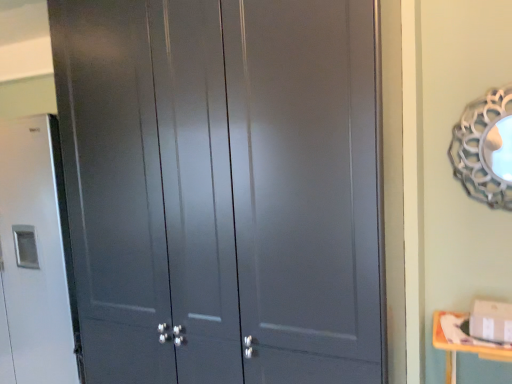
Question: Is matte gray cabinet at center turned away from matte gray cabinet at left?

Choices:
 (A) yes
 (B) no

Answer: (B)

Question: Does matte gray cabinet at center have a larger size compared to matte gray cabinet at left?

Choices:
 (A) no
 (B) yes

Answer: (B)

Question: Can you confirm if matte gray cabinet at center is positioned to the left of matte gray cabinet at left?

Choices:
 (A) yes
 (B) no

Answer: (B)

Question: From a real-world perspective, is matte gray cabinet at center physically below matte gray cabinet at left?

Choices:
 (A) no
 (B) yes

Answer: (A)

Question: From the image's perspective, is matte gray cabinet at center on matte gray cabinet at left?

Choices:
 (A) yes
 (B) no

Answer: (A)

Question: Is matte gray cabinet at center positioned before matte gray cabinet at left?

Choices:
 (A) yes
 (B) no

Answer: (A)

Question: Is metallic silver mirror at upper right bigger than yellow wood changing table at lower right?

Choices:
 (A) no
 (B) yes

Answer: (A)

Question: Can you confirm if metallic silver mirror at upper right is taller than yellow wood changing table at lower right?

Choices:
 (A) yes
 (B) no

Answer: (A)

Question: Is metallic silver mirror at upper right positioned with its back to yellow wood changing table at lower right?

Choices:
 (A) yes
 (B) no

Answer: (B)

Question: Considering the relative sizes of metallic silver mirror at upper right and yellow wood changing table at lower right in the image provided, is metallic silver mirror at upper right thinner than yellow wood changing table at lower right?

Choices:
 (A) no
 (B) yes

Answer: (B)

Question: From the image's perspective, is metallic silver mirror at upper right on top of yellow wood changing table at lower right?

Choices:
 (A) no
 (B) yes

Answer: (B)

Question: Is metallic silver mirror at upper right wider than yellow wood changing table at lower right?

Choices:
 (A) no
 (B) yes

Answer: (A)

Question: Is yellow wood changing table at lower right positioned with its back to matte gray cabinet at center?

Choices:
 (A) yes
 (B) no

Answer: (B)